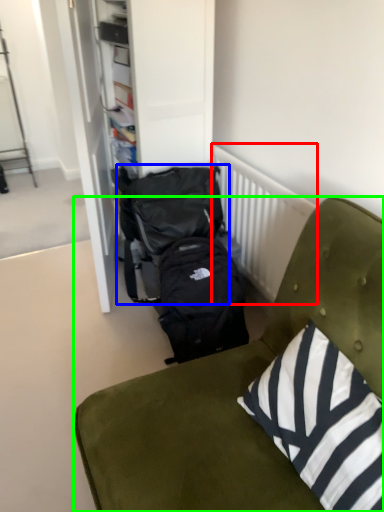
Question: Which is farther away from radiator (highlighted by a red box)? backpack (highlighted by a blue box) or furniture (highlighted by a green box)?

Choices:
 (A) backpack
 (B) furniture

Answer: (B)